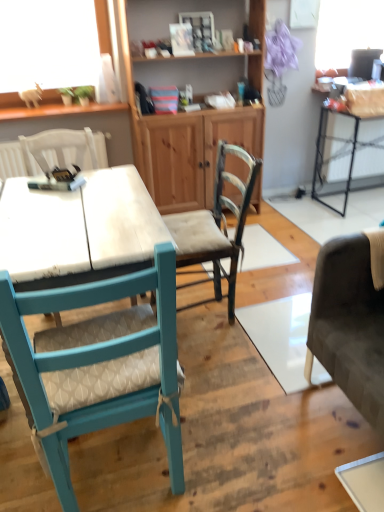
Question: From a real-world perspective, is wooden textured chair at center, positioned as the first chair in right-to-left order, positioned over metallic black table at right based on gravity?

Choices:
 (A) yes
 (B) no

Answer: (A)

Question: Considering the relative sizes of wooden textured chair at center, arranged as the third chair when viewed from the left, and metallic black table at right in the image provided, is wooden textured chair at center, arranged as the third chair when viewed from the left, shorter than metallic black table at right?

Choices:
 (A) yes
 (B) no

Answer: (B)

Question: Could you tell me if wooden textured chair at center, arranged as the third chair when viewed from the left, is turned towards metallic black table at right?

Choices:
 (A) yes
 (B) no

Answer: (B)

Question: Is wooden textured chair at center, arranged as the third chair when viewed from the left, not within metallic black table at right?

Choices:
 (A) yes
 (B) no

Answer: (A)

Question: Can you confirm if wooden textured chair at center, positioned as the first chair in right-to-left order, is smaller than metallic black table at right?

Choices:
 (A) yes
 (B) no

Answer: (A)

Question: Would you say metallic black table at right is to the left or to the right of wooden cabinet at center in the picture?

Choices:
 (A) left
 (B) right

Answer: (B)

Question: In terms of height, does metallic black table at right look taller or shorter compared to wooden cabinet at center?

Choices:
 (A) short
 (B) tall

Answer: (A)

Question: Relative to wooden cabinet at center, is metallic black table at right in front or behind?

Choices:
 (A) front
 (B) behind

Answer: (B)

Question: Is metallic black table at right wider or thinner than wooden cabinet at center?

Choices:
 (A) thin
 (B) wide

Answer: (B)

Question: Which is correct: metallic black table at right is inside teal fabric chair at left, arranged as the second chair when viewed from the left, or outside of it?

Choices:
 (A) outside
 (B) inside

Answer: (A)

Question: Considering their positions, is metallic black table at right located in front of or behind teal fabric chair at left, arranged as the second chair when viewed from the left?

Choices:
 (A) front
 (B) behind

Answer: (B)

Question: From a real-world perspective, is metallic black table at right physically located above or below teal fabric chair at left, which is the 2th chair in right-to-left order?

Choices:
 (A) below
 (B) above

Answer: (A)

Question: Is point (327, 111) closer or farther from the camera than point (44, 393)?

Choices:
 (A) farther
 (B) closer

Answer: (A)

Question: From the image's perspective, is wooden textured chair at center, positioned as the first chair in right-to-left order, positioned above or below metallic black table at right?

Choices:
 (A) below
 (B) above

Answer: (A)

Question: Based on their positions, is wooden textured chair at center, positioned as the first chair in right-to-left order, located to the left or right of metallic black table at right?

Choices:
 (A) left
 (B) right

Answer: (A)